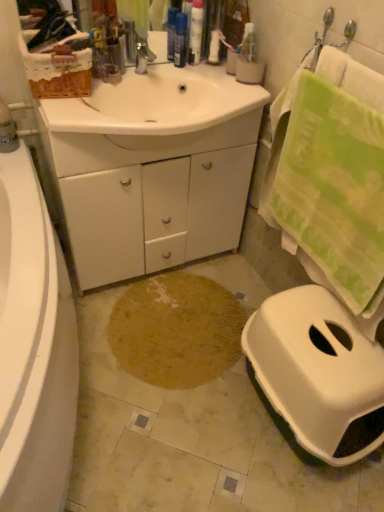
Question: In which direction should I rotate to look at white glossy tube at upper center, which is counted as the second toiletry, starting from the right?

Choices:
 (A) left
 (B) right

Answer: (B)

Question: Is white plastic toilet at lower right behind translucent plastic bottles at upper center, the 3th toiletry from the right?

Choices:
 (A) no
 (B) yes

Answer: (A)

Question: Could translucent plastic bottles at upper center, marked as the first toiletry in a left-to-right arrangement, be considered to be inside white plastic toilet at lower right?

Choices:
 (A) yes
 (B) no

Answer: (B)

Question: Can you confirm if white plastic toilet at lower right is thinner than translucent plastic bottles at upper center, marked as the first toiletry in a left-to-right arrangement?

Choices:
 (A) yes
 (B) no

Answer: (B)

Question: Is white plastic toilet at lower right facing towards translucent plastic bottles at upper center, the 3th toiletry from the right?

Choices:
 (A) yes
 (B) no

Answer: (B)

Question: Is white plastic toilet at lower right at the right side of translucent plastic bottles at upper center, the 3th toiletry from the right?

Choices:
 (A) no
 (B) yes

Answer: (B)

Question: Does white plastic toilet at lower right have a larger size compared to translucent plastic bottles at upper center, the 3th toiletry from the right?

Choices:
 (A) no
 (B) yes

Answer: (B)

Question: Considering the relative sizes of white glossy cabinet at center and white plastic bottle at upper center, which is the 3th toiletry in left-to-right order, in the image provided, is white glossy cabinet at center thinner than white plastic bottle at upper center, which is the 3th toiletry in left-to-right order,?

Choices:
 (A) yes
 (B) no

Answer: (B)

Question: Is white glossy cabinet at center aimed at white plastic bottle at upper center, marked as the first toiletry in a right-to-left arrangement?

Choices:
 (A) no
 (B) yes

Answer: (A)

Question: Is white glossy cabinet at center at the right side of white plastic bottle at upper center, marked as the first toiletry in a right-to-left arrangement?

Choices:
 (A) no
 (B) yes

Answer: (A)

Question: Is white glossy cabinet at center in front of white plastic bottle at upper center, marked as the first toiletry in a right-to-left arrangement?

Choices:
 (A) no
 (B) yes

Answer: (B)

Question: From a real-world perspective, is white glossy cabinet at center over white plastic bottle at upper center, which is the 3th toiletry in left-to-right order?

Choices:
 (A) yes
 (B) no

Answer: (B)

Question: Does white glossy cabinet at center come behind white plastic bottle at upper center, marked as the first toiletry in a right-to-left arrangement?

Choices:
 (A) no
 (B) yes

Answer: (A)

Question: Does translucent plastic bottles at upper center, the 3th toiletry from the right, have a greater width compared to brown textured rug at center?

Choices:
 (A) no
 (B) yes

Answer: (A)